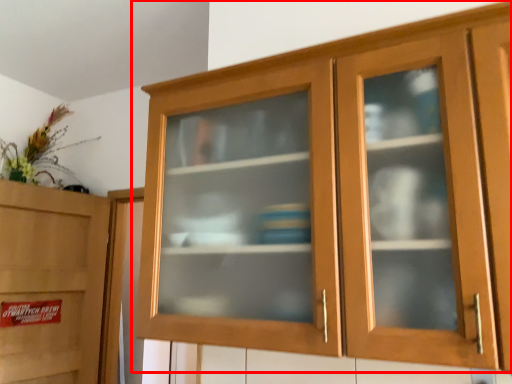
Question: Considering the relative positions of cupboard (annotated by the red box) and cabinetry in the image provided, where is cupboard (annotated by the red box) located with respect to the staircase?

Choices:
 (A) right
 (B) left

Answer: (A)